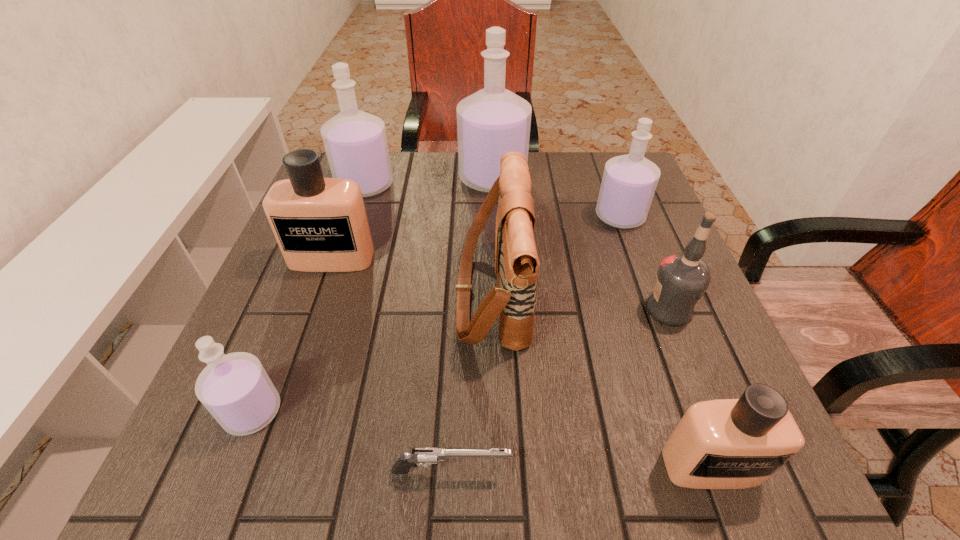
Where is `the fourth closest perfume to the seventh farthest object`? This screenshot has width=960, height=540. the fourth closest perfume to the seventh farthest object is located at coordinates (493, 121).

The image size is (960, 540). I want to click on purple perfume that stands as the fourth closest to the pistol, so click(493, 121).

Identify which purple perfume is located as the third nearest to the vodka. Please provide its 2D coordinates. Your answer should be formatted as a tuple, i.e. [(x, y)], where the tuple contains the x and y coordinates of a point satisfying the conditions above.

[(355, 142)]